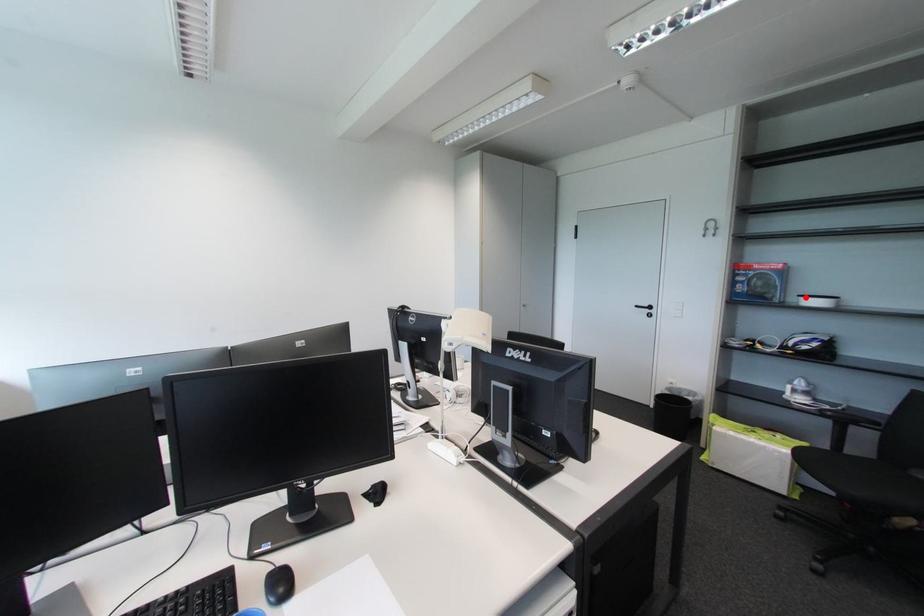
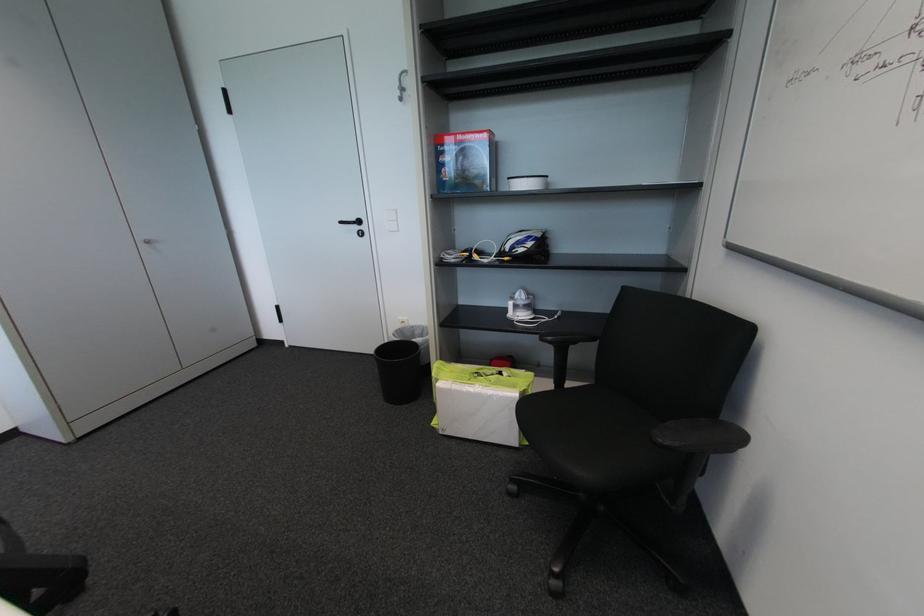
In the second image, find the point that corresponds to the highlighted location in the first image.

(516, 180)